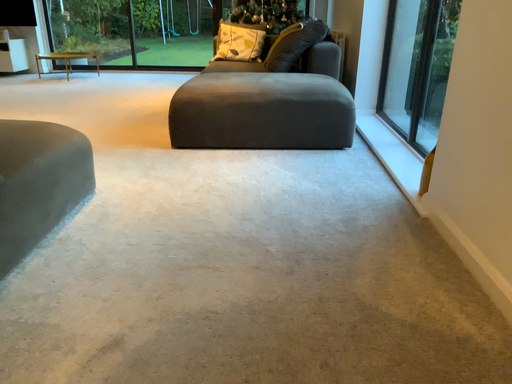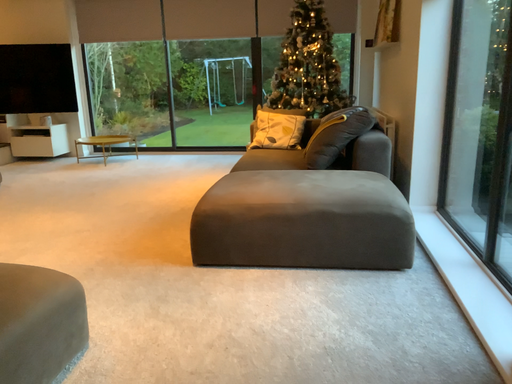
Question: Which way did the camera rotate in the video?

Choices:
 (A) rotated right
 (B) rotated left

Answer: (B)